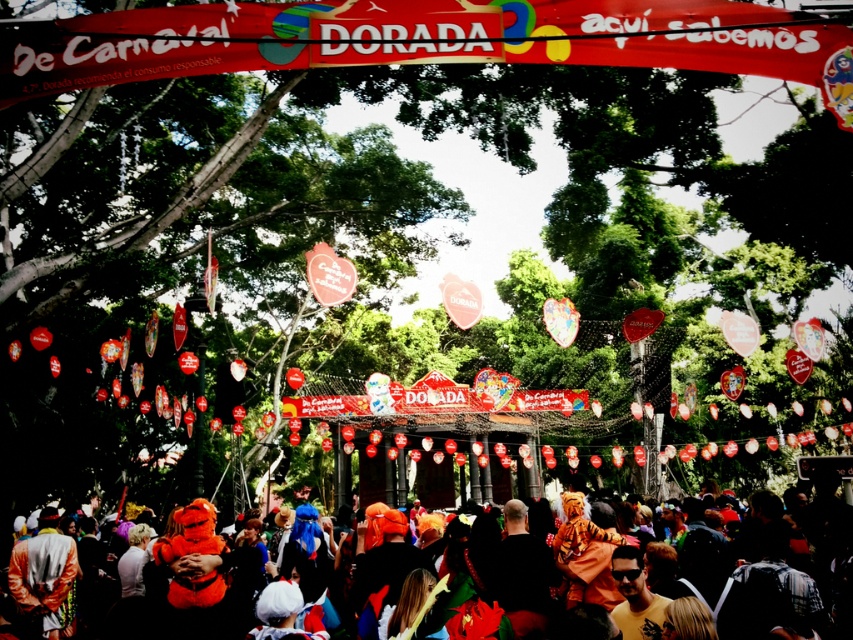
What is located at the coordinates point (422,40) in the image?

The red fabric banner at upper center is located at point (422,40).

Based on the photo, you are standing at the center of the event area and want to locate the red fabric banner at upper center. According to the coordinates provided, where should you look to find it?

The red fabric banner at upper center is located at coordinates point (x=422, y=40), so you should look towards the upper center direction to find it.